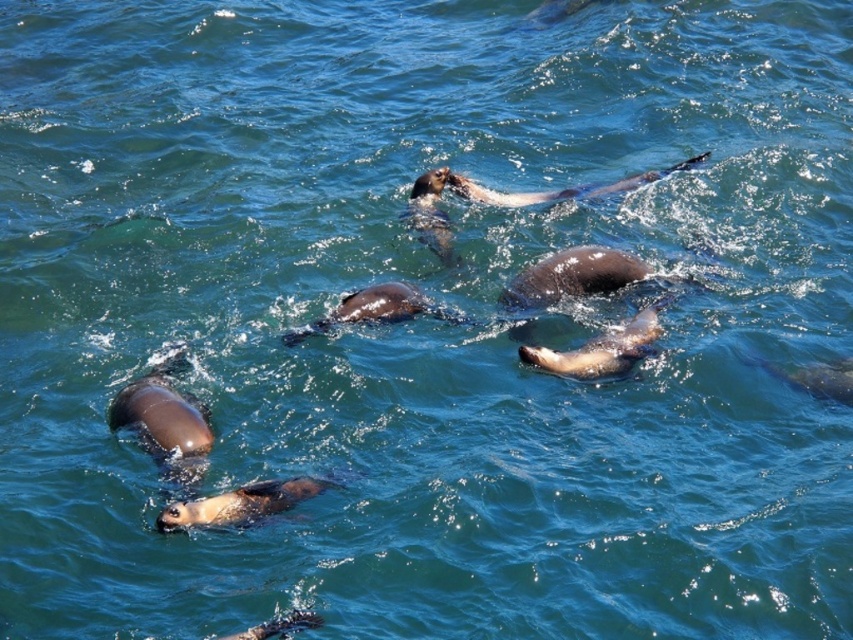
Question: Can you confirm if brown fur seal at lower center is wider than brown fur seal at center?

Choices:
 (A) yes
 (B) no

Answer: (B)

Question: Which object is the closest to the brown fur seal at lower center?

Choices:
 (A) brown fur seal at upper center
 (B) brown fur seal at center

Answer: (B)

Question: Is brown fur seal at center smaller than brown fur seal at upper center?

Choices:
 (A) no
 (B) yes

Answer: (B)

Question: Based on their relative distances, which object is nearer to the brown fur seal at lower center?

Choices:
 (A) brown fur seal at center
 (B) brown fur seal at upper center

Answer: (A)

Question: Can you confirm if brown fur seal at center is positioned above brown fur seal at upper center?

Choices:
 (A) yes
 (B) no

Answer: (B)

Question: Which point is closer to the camera taking this photo?

Choices:
 (A) tap(297, 480)
 (B) tap(583, 352)

Answer: (A)